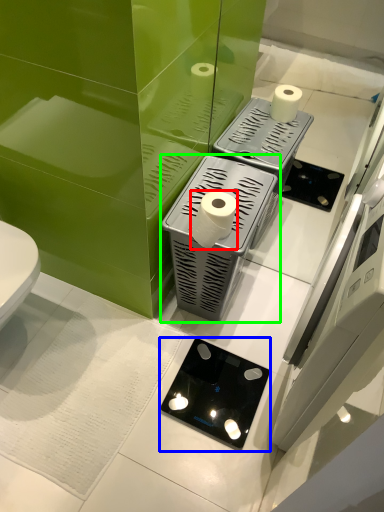
Question: Which object is positioned closest to toilet paper (highlighted by a red box)? Select from appliance (highlighted by a blue box) and appliance (highlighted by a green box).

Choices:
 (A) appliance
 (B) appliance

Answer: (B)